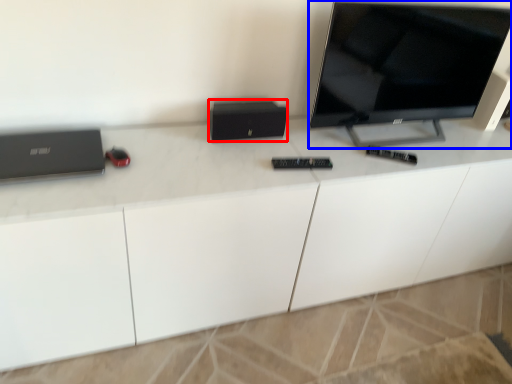
Question: Which object is closer to the camera taking this photo, computer (highlighted by a red box) or television (highlighted by a blue box)?

Choices:
 (A) computer
 (B) television

Answer: (B)